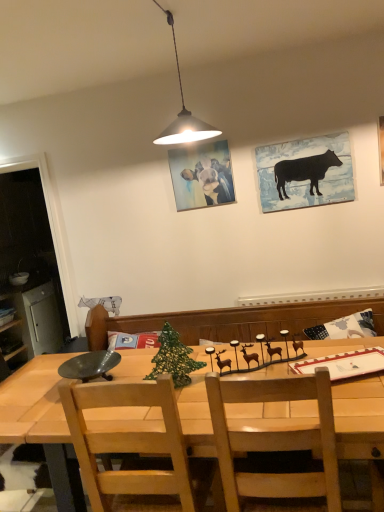
Question: In terms of width, does light brown wooden chair at center look wider or thinner when compared to green mesh christmas tree at center?

Choices:
 (A) wide
 (B) thin

Answer: (A)

Question: Based on their positions, is light brown wooden chair at center located to the left or right of green mesh christmas tree at center?

Choices:
 (A) right
 (B) left

Answer: (B)

Question: Estimate the real-world distances between objects in this image. Which object is closer to the light brown wooden chair at center?

Choices:
 (A) green mesh christmas tree at center
 (B) wooden table at center
 (C) brushed metal cabinet at left
 (D) matte oil painting of cow at center, which ranks as the second picture frame in right-to-left order
 (E) black matte cow at upper right, the 2th picture frame in the left-to-right sequence

Answer: (B)

Question: Based on their relative distances, which object is nearer to the green mesh christmas tree at center?

Choices:
 (A) brushed metal cabinet at left
 (B) black matte cow at upper right, which is the first picture frame in right-to-left order
 (C) matte oil painting of cow at center, the 1th picture frame from the left
 (D) wooden table at center
 (E) light brown wooden chair at center

Answer: (E)